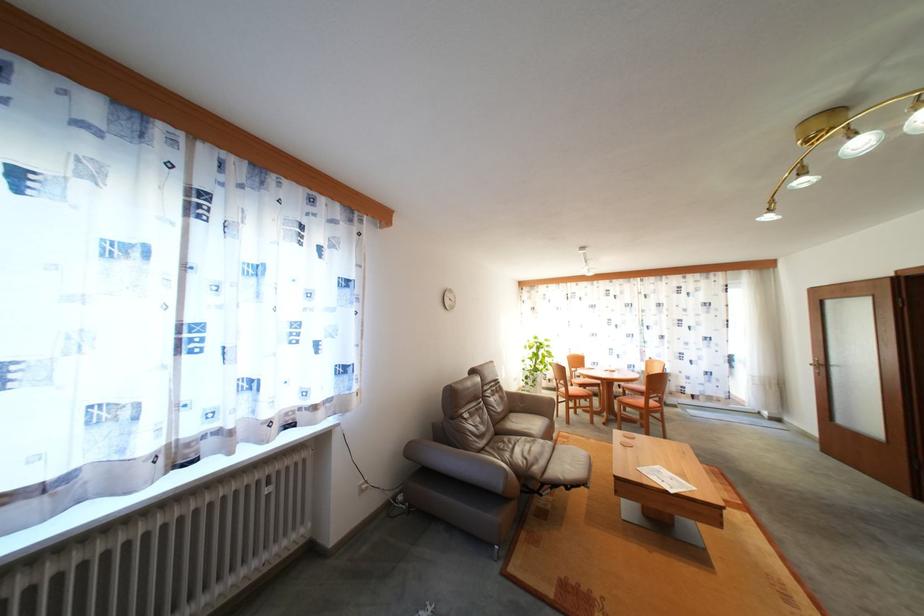
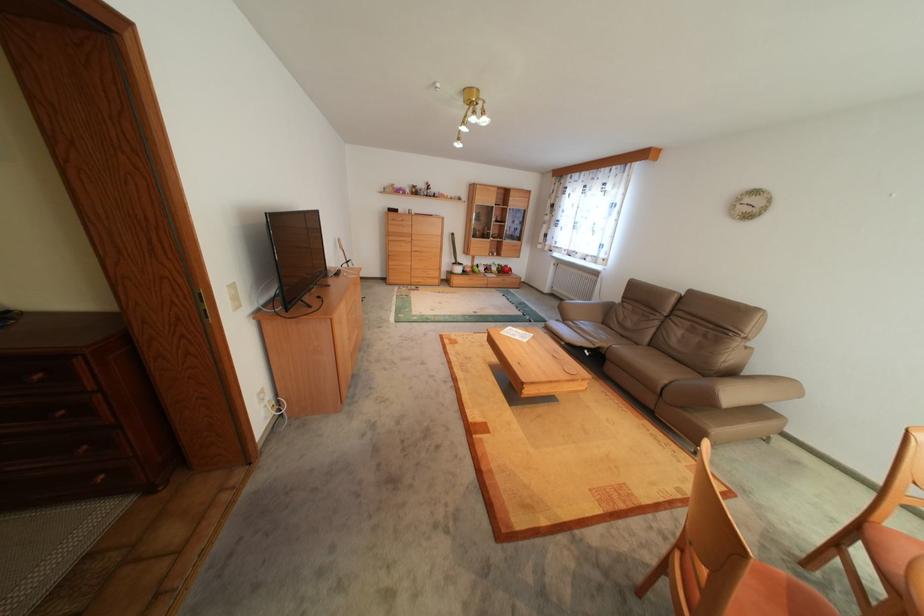
In the second image, find the point that corresponds to the point at 507,390 in the first image.

(715, 334)